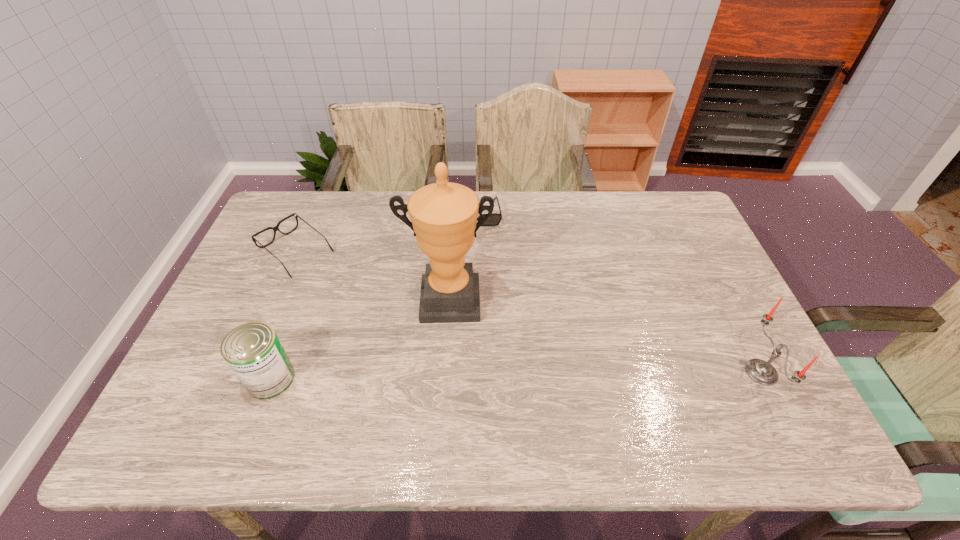
Locate an element on the screen. free area in between the award and the spectacles is located at coordinates (372, 276).

This screenshot has width=960, height=540. Identify the location of vacant space in between the fourth shortest object and the tallest object. (605, 336).

The width and height of the screenshot is (960, 540). Find the location of `empty space that is in between the award and the second tallest object`. empty space that is in between the award and the second tallest object is located at coordinates (605, 336).

The width and height of the screenshot is (960, 540). I want to click on free space between the third tallest object and the spectacles, so click(x=283, y=315).

Choose which object is the third nearest neighbor to the tallest object. Please provide its 2D coordinates. Your answer should be formatted as a tuple, i.e. [(x, y)], where the tuple contains the x and y coordinates of a point satisfying the conditions above.

[(253, 351)]

In order to click on object that is the third nearest to the spectacles in this screenshot , I will do `click(494, 220)`.

Where is `vacant space that satisfies the following two spatial constraints: 1. on the front side of the spectacles; 2. on the left side of the tallest object`? vacant space that satisfies the following two spatial constraints: 1. on the front side of the spectacles; 2. on the left side of the tallest object is located at coordinates (276, 300).

Image resolution: width=960 pixels, height=540 pixels. In order to click on vacant space that satisfies the following two spatial constraints: 1. on the front side of the spectacles; 2. on the front-facing side of the candle in this screenshot , I will do `click(245, 372)`.

Where is `vacant position in the image that satisfies the following two spatial constraints: 1. on the back side of the award; 2. on the left side of the sunglasses`? vacant position in the image that satisfies the following two spatial constraints: 1. on the back side of the award; 2. on the left side of the sunglasses is located at coordinates (454, 214).

At what (x,y) coordinates should I click in order to perform the action: click on vacant space that satisfies the following two spatial constraints: 1. on the front side of the rightmost object; 2. on the front-facing side of the sunglasses. Please return your answer as a coordinate pair (x, y). This screenshot has height=540, width=960. Looking at the image, I should click on (472, 372).